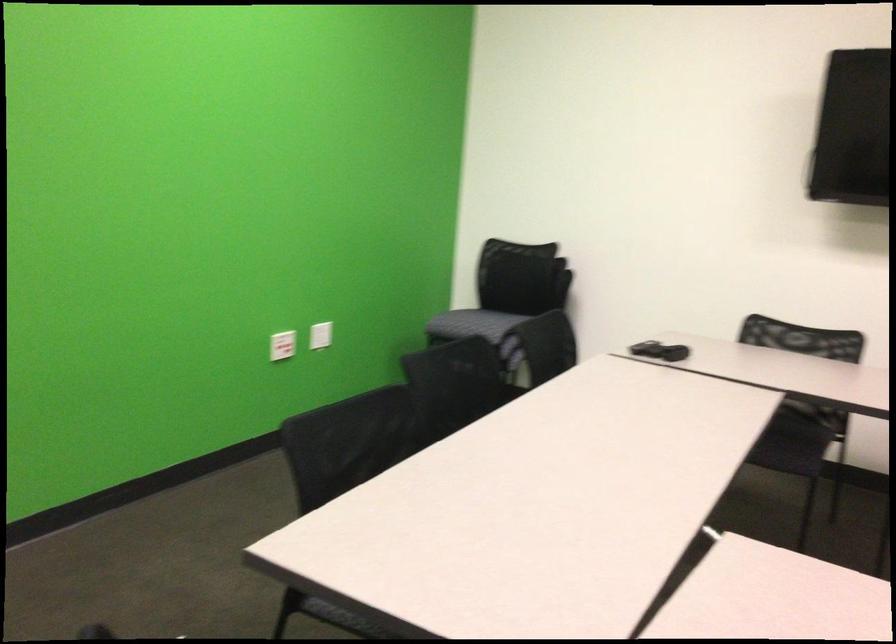
The height and width of the screenshot is (644, 896). Describe the element at coordinates (321, 335) in the screenshot. I see `a white electrical outlet` at that location.